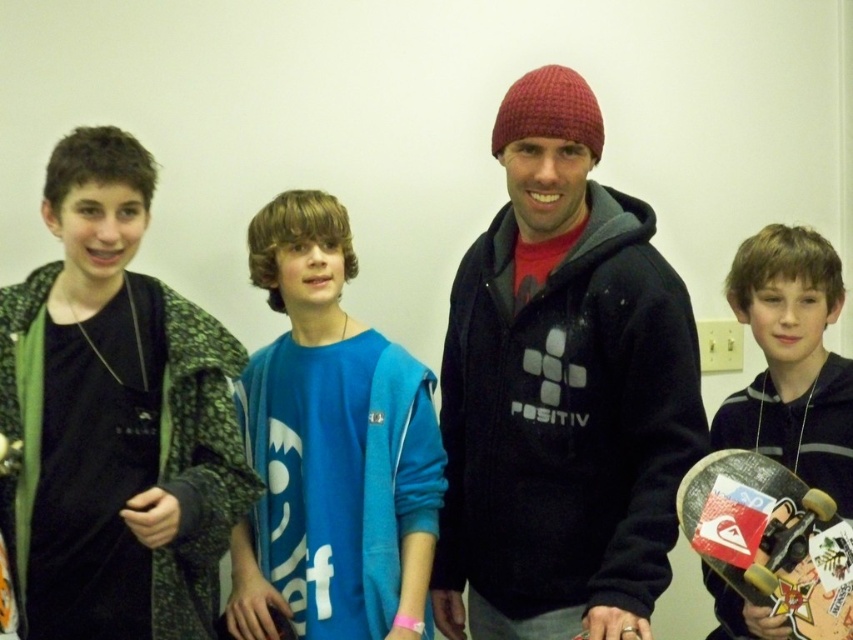
You are standing in the room and want to pick up the matte black skateboard at right and the black matte skateboard at lower right. Which skateboard is closer to your right side?

The matte black skateboard at right is positioned on the right side of black matte skateboard at lower right, so the matte black skateboard at right is closer to your right side.